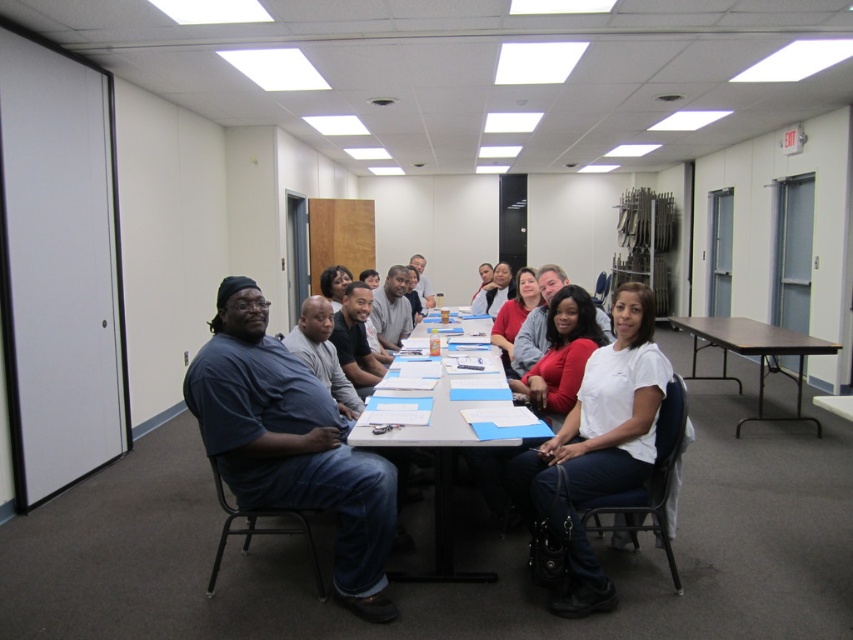
Question: Which point is farther from the camera taking this photo?

Choices:
 (A) (556, 600)
 (B) (738, 337)
 (C) (360, 444)

Answer: (B)

Question: Based on their relative distances, which object is nearer to the white plastic table at center?

Choices:
 (A) matte blue shirt at center
 (B) white matte shirt at center

Answer: (A)

Question: Where is matte blue shirt at center located in relation to dark blue shirt at center in the image?

Choices:
 (A) left
 (B) right

Answer: (B)

Question: Is the position of white matte shirt at center more distant than that of white plastic table at center?

Choices:
 (A) no
 (B) yes

Answer: (B)

Question: Which point is closer to the camera?

Choices:
 (A) dark blue shirt at center
 (B) matte blue shirt at center

Answer: (B)

Question: Is the position of white matte shirt at center less distant than that of brown/metallic table at right?

Choices:
 (A) no
 (B) yes

Answer: (B)